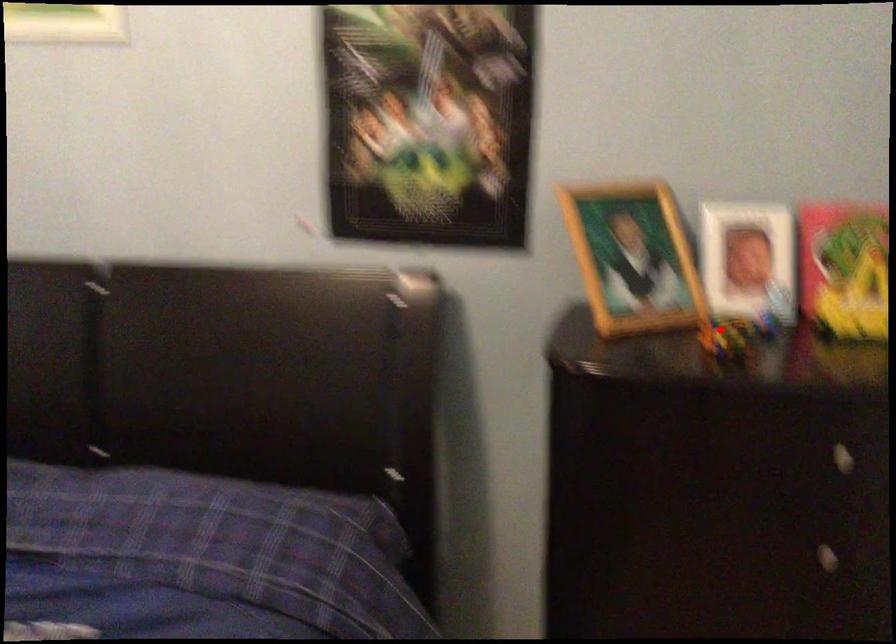
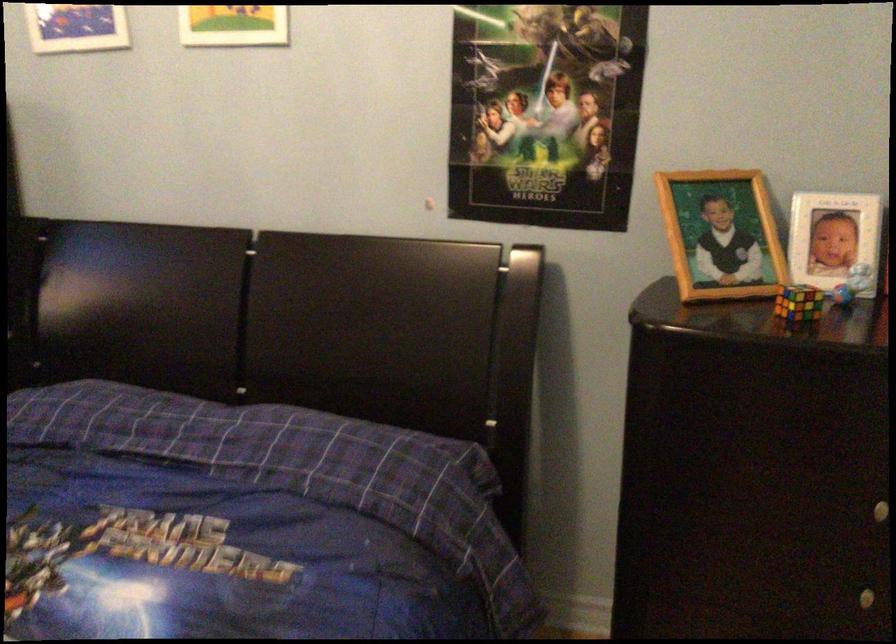
Find the pixel in the second image that matches the highlighted location in the first image.

(798, 303)